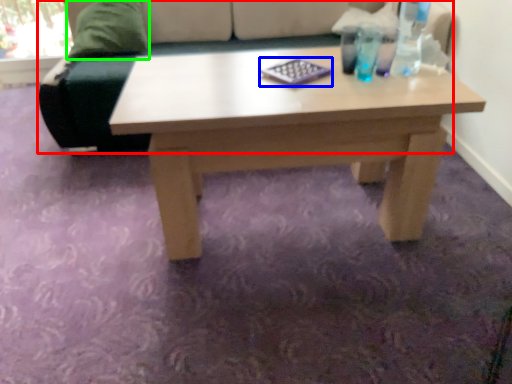
Question: Estimate the real-world distances between objects in this image. Which object is closer to studio couch (highlighted by a red box), pad (highlighted by a blue box) or pillow (highlighted by a green box)?

Choices:
 (A) pad
 (B) pillow

Answer: (B)